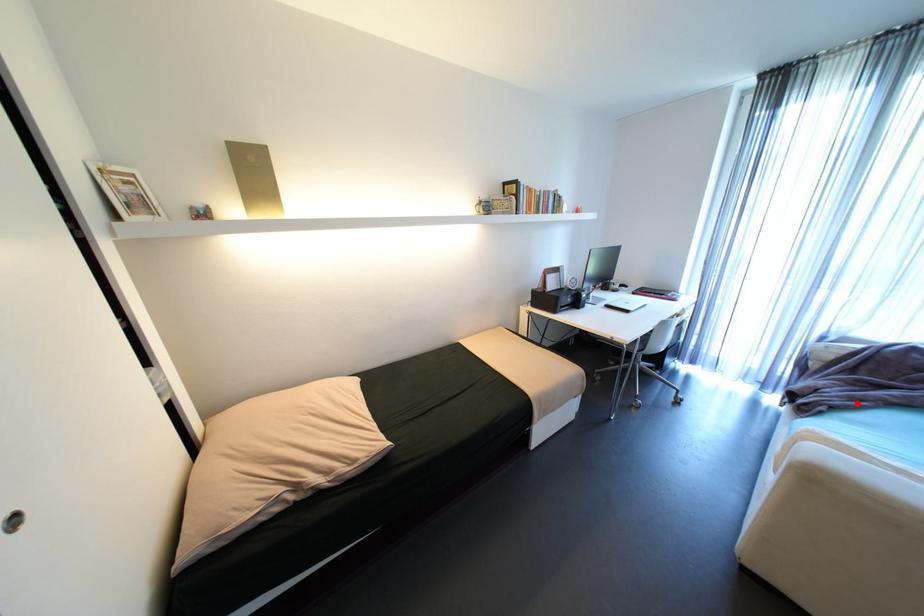
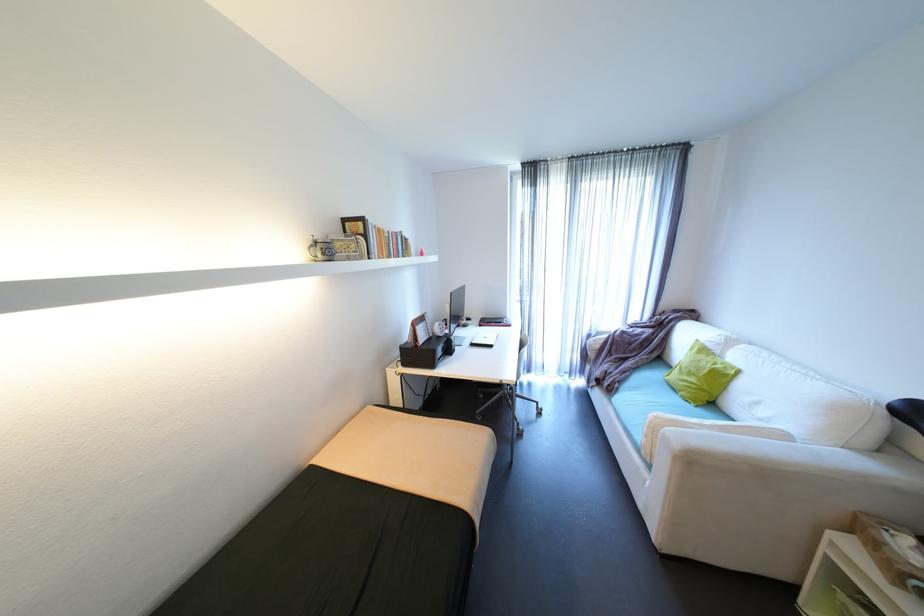
Question: I am providing you with two images of the same scene from different viewpoints. A red point is shown in image1. For the corresponding object point in image2, is it positioned nearer or farther from the camera?

Choices:
 (A) Nearer
 (B) Farther

Answer: (A)